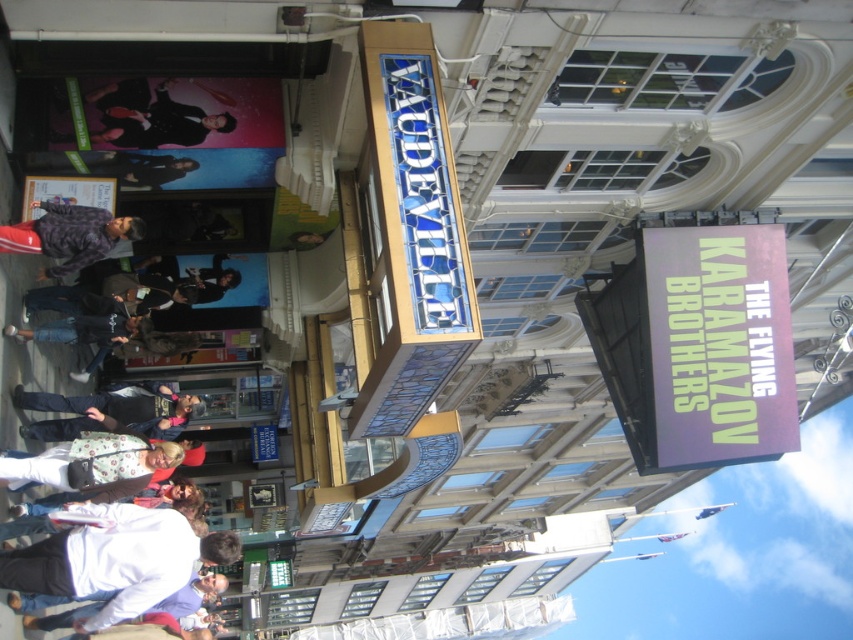
You are an actor preparing to enter the theater for a performance. You see a shiny black suit at upper left and a plaid fabric shirt at lower left. Which clothing item is closer to you?

The shiny black suit at upper left is closer to you because the plaid fabric shirt at lower left is behind it.